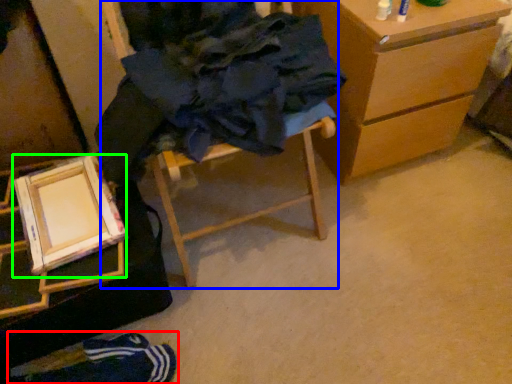
Question: Considering the real-world distances, which object is closest to person (highlighted by a red box)? furniture (highlighted by a blue box) or picture frame (highlighted by a green box).

Choices:
 (A) furniture
 (B) picture frame

Answer: (B)